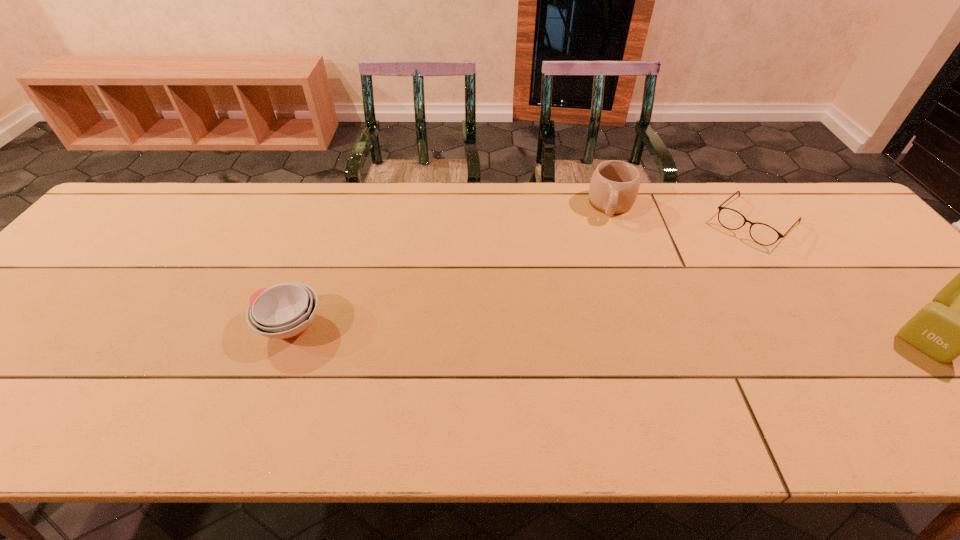
Where is `blank region between the shortest object and the soup bowl`? Image resolution: width=960 pixels, height=540 pixels. blank region between the shortest object and the soup bowl is located at coordinates (522, 274).

Identify the location of vacant area that lies between the second object from left to right and the soup bowl. This screenshot has width=960, height=540. (450, 265).

The width and height of the screenshot is (960, 540). In order to click on vacant space that is in between the mug and the shortest object in this screenshot , I will do point(684,214).

Locate an element on the screen. The width and height of the screenshot is (960, 540). object that is the third nearest to the second object from left to right is located at coordinates (284, 311).

Identify which object is located as the second nearest to the third object from left to right. Please provide its 2D coordinates. Your answer should be formatted as a tuple, i.e. [(x, y)], where the tuple contains the x and y coordinates of a point satisfying the conditions above.

[(614, 186)]